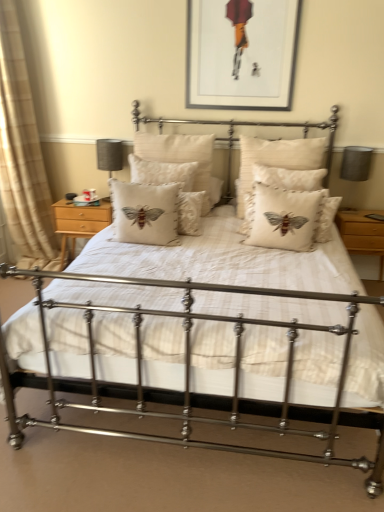
The image size is (384, 512). In order to click on free spot above matte gray lampshade at right, the second table lamp positioned from the left (from a real-world perspective) in this screenshot , I will do `click(354, 150)`.